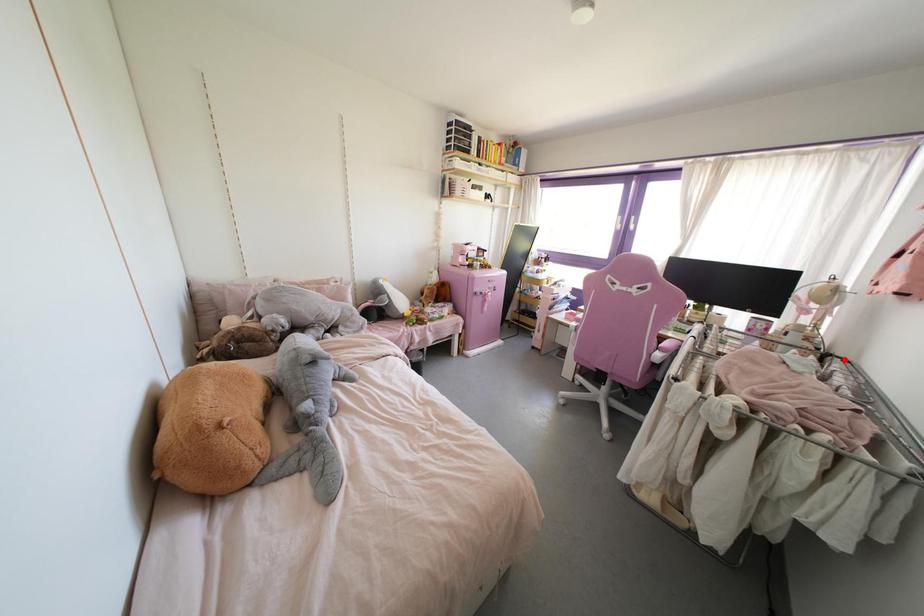
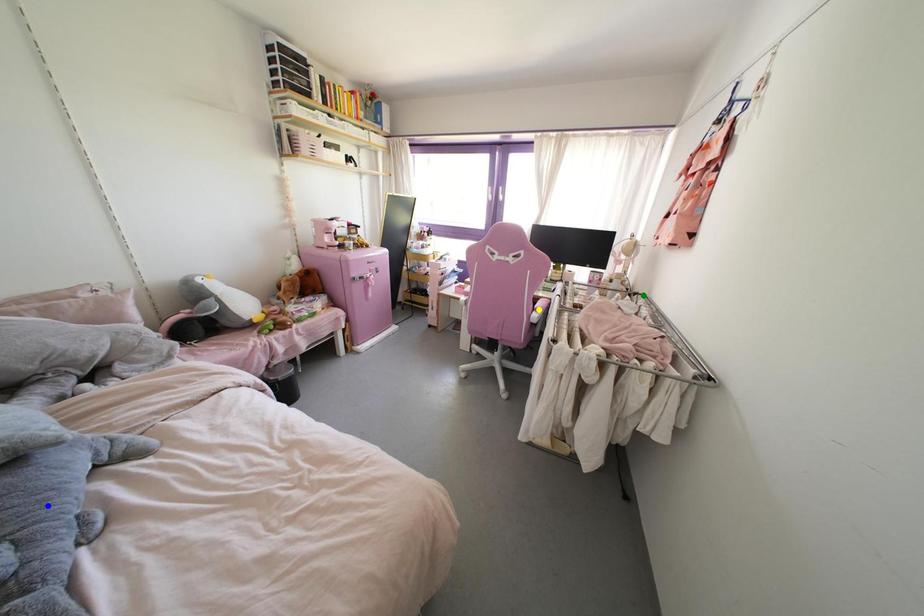
Question: I am providing you with two images of the same scene from different viewpoints. A red point is marked on the first image. You are given multiple points on the second image. Which point in image 2 is actually the same real-world point as the red point in image 1?

Choices:
 (A) blue point
 (B) green point
 (C) yellow point

Answer: (B)